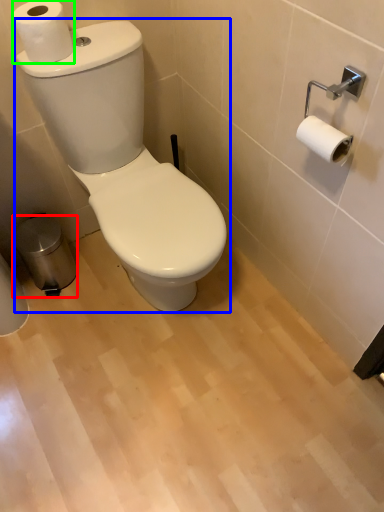
Question: Estimate the real-world distances between objects in this image. Which object is farther from trash bin/can (highlighted by a red box), toilet (highlighted by a blue box) or toilet paper (highlighted by a green box)?

Choices:
 (A) toilet
 (B) toilet paper

Answer: (B)